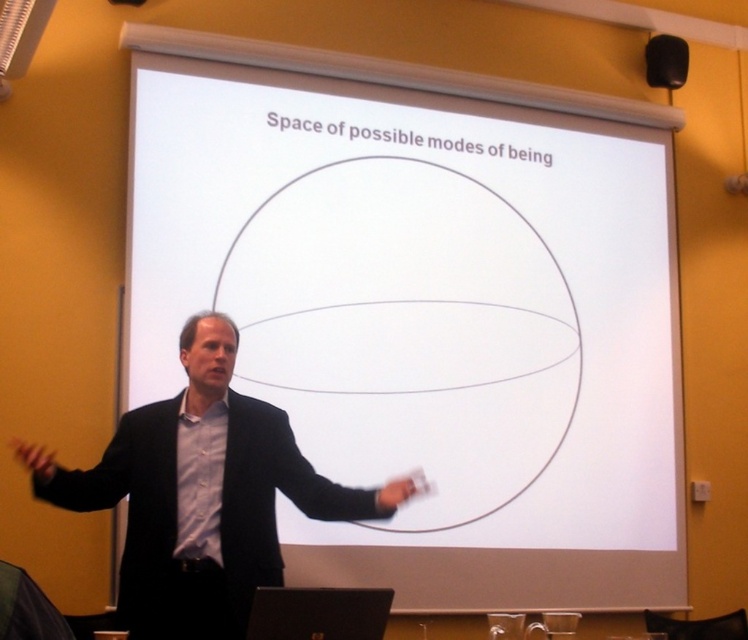
Question: Which of the following is the closest to the observer?

Choices:
 (A) (663, 67)
 (B) (278, 438)

Answer: (B)

Question: Which of the following is the closest to the observer?

Choices:
 (A) (660, 67)
 (B) (503, 396)
 (C) (209, 620)

Answer: (C)

Question: Can you confirm if white matte projection screen at center is positioned above black matte speaker at upper right?

Choices:
 (A) yes
 (B) no

Answer: (B)

Question: Which object is the closest to the black matte speaker at upper right?

Choices:
 (A) black matte suit at left
 (B) white matte projection screen at center

Answer: (B)

Question: Can you confirm if white matte projection screen at center is bigger than black matte suit at left?

Choices:
 (A) yes
 (B) no

Answer: (A)

Question: Does black matte suit at left come behind black matte speaker at upper right?

Choices:
 (A) yes
 (B) no

Answer: (B)